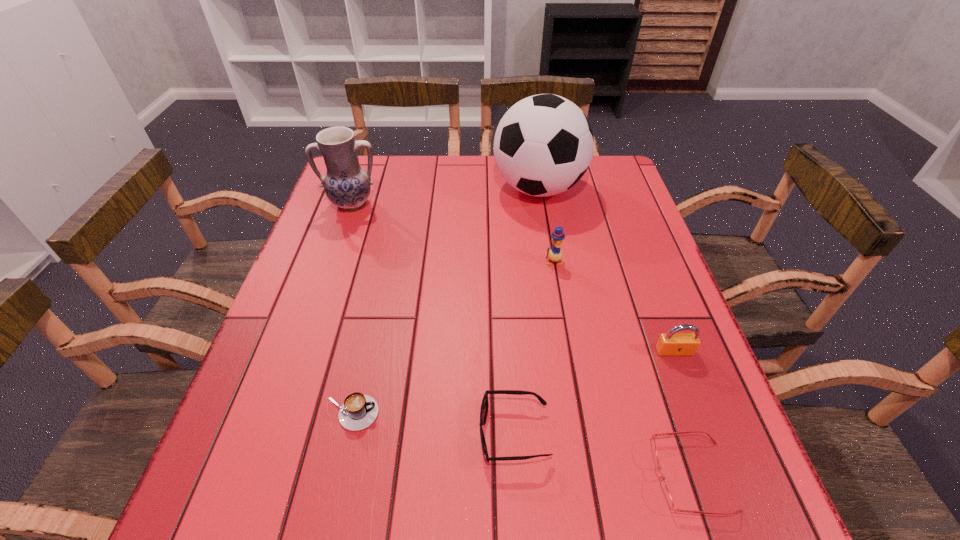
I want to click on vacant area between the sunglasses and the fourth tallest object, so click(x=594, y=393).

The image size is (960, 540). In order to click on vacant space that's between the duckling and the sunglasses in this screenshot , I will do `click(534, 348)`.

You are a GUI agent. You are given a task and a screenshot of the screen. Output one action in this format:
    pyautogui.click(x=<x>, y=<y>)
    Task: Click on the unoccupied position between the cappuccino and the fifth shortest object
    
    Given the screenshot: What is the action you would take?
    pyautogui.click(x=452, y=338)

This screenshot has height=540, width=960. What are the coordinates of `free space between the padlock and the duckling` in the screenshot? It's located at (613, 306).

At what (x,y) coordinates should I click in order to perform the action: click on free space that is in between the padlock and the third tallest object. Please return your answer as a coordinate pair (x, y). Looking at the image, I should click on (613, 306).

The height and width of the screenshot is (540, 960). What are the coordinates of `empty space that is in between the cappuccino and the pottery` in the screenshot? It's located at (352, 309).

Identify the location of free space between the pottery and the tallest object. The width and height of the screenshot is (960, 540). (445, 197).

The image size is (960, 540). I want to click on object that is the nearest to the tallest object, so click(x=555, y=254).

Locate an element on the screen. Image resolution: width=960 pixels, height=540 pixels. object that can be found as the fifth closest to the soccer ball is located at coordinates (359, 411).

Identify the location of free space that satisfies the following two spatial constraints: 1. on the face of the third tallest object, where the monocle is placed; 2. on the front-facing side of the sunglasses. Image resolution: width=960 pixels, height=540 pixels. (583, 434).